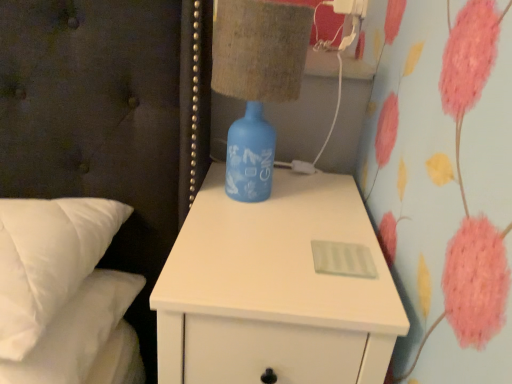
Question: Is the surface of white soft pillows at left in direct contact with white matte nightstand at center?

Choices:
 (A) no
 (B) yes

Answer: (A)

Question: Does white soft pillows at left come behind white matte nightstand at center?

Choices:
 (A) no
 (B) yes

Answer: (A)

Question: Is white soft pillows at left to the left of white matte nightstand at center from the viewer's perspective?

Choices:
 (A) yes
 (B) no

Answer: (A)

Question: From a real-world perspective, is white soft pillows at left positioned over white matte nightstand at center based on gravity?

Choices:
 (A) no
 (B) yes

Answer: (B)

Question: From the image's perspective, would you say white soft pillows at left is shown under white matte nightstand at center?

Choices:
 (A) no
 (B) yes

Answer: (A)

Question: Is blue glass bottle at upper right to the left or to the right of white plastic electric outlet at upper right in the image?

Choices:
 (A) left
 (B) right

Answer: (A)

Question: Do you think blue glass bottle at upper right is within white plastic electric outlet at upper right, or outside of it?

Choices:
 (A) outside
 (B) inside

Answer: (A)

Question: Is blue glass bottle at upper right in front of or behind white plastic electric outlet at upper right in the image?

Choices:
 (A) front
 (B) behind

Answer: (A)

Question: From the image's perspective, is blue glass bottle at upper right above or below white plastic electric outlet at upper right?

Choices:
 (A) below
 (B) above

Answer: (A)

Question: From a real-world perspective, is white soft pillows at left above or below white matte nightstand at center?

Choices:
 (A) above
 (B) below

Answer: (A)

Question: Is white soft pillows at left inside the boundaries of white matte nightstand at center, or outside?

Choices:
 (A) outside
 (B) inside

Answer: (A)

Question: From the image's perspective, relative to white matte nightstand at center, is white soft pillows at left above or below?

Choices:
 (A) below
 (B) above

Answer: (B)

Question: Considering the positions of point (20, 314) and point (295, 344), is point (20, 314) closer or farther from the camera than point (295, 344)?

Choices:
 (A) closer
 (B) farther

Answer: (A)

Question: Does point (353, 296) appear closer or farther from the camera than point (136, 336)?

Choices:
 (A) closer
 (B) farther

Answer: (A)

Question: Is white matte nightstand at center situated inside white soft pillows at left or outside?

Choices:
 (A) outside
 (B) inside

Answer: (A)